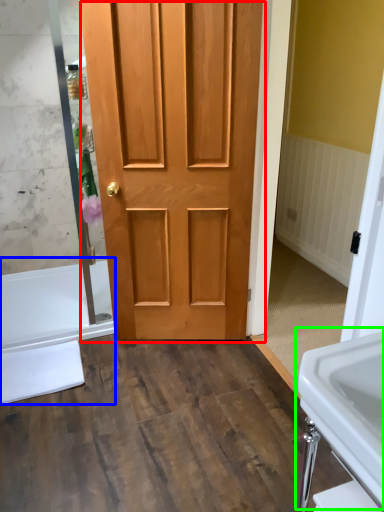
Question: Based on their relative distances, which object is farther from door (highlighted by a red box)? Choose from bath (highlighted by a blue box) and sink (highlighted by a green box).

Choices:
 (A) bath
 (B) sink

Answer: (B)